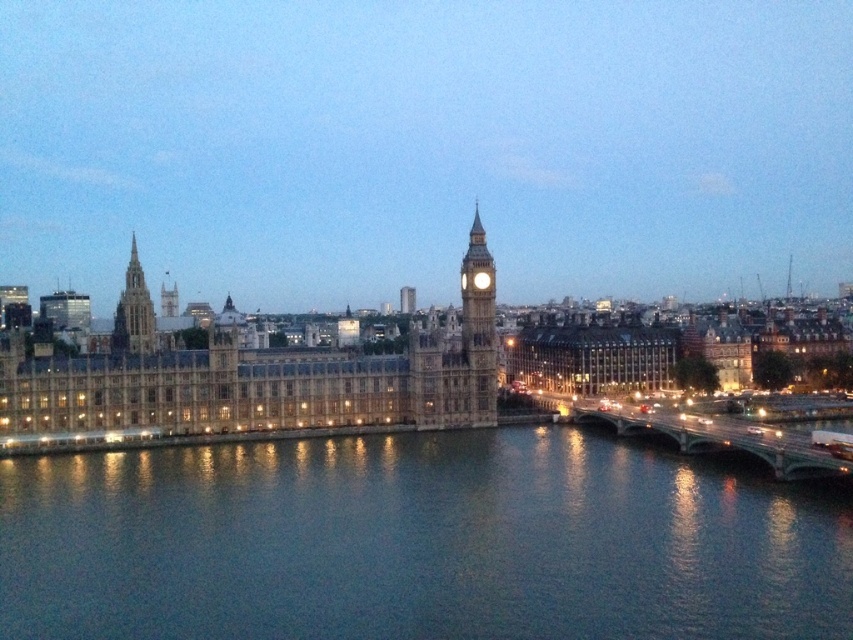
Based on the coordinates provided, which object in the scene is located at point (264, 381)?

The golden stone palace at center is located at point (264, 381).

You are a tourist standing on the bridge over the River Thames. You see the golden stone palace at center and the stone clock tower at center. Which one is closer to you?

The golden stone palace at center is closer to you because it is in front of the stone clock tower at center.